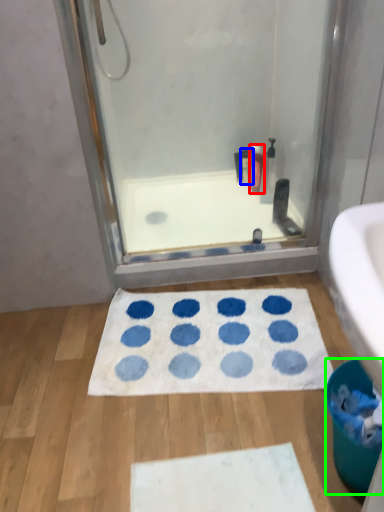
Question: Which object is positioned farthest from cleaning product (highlighted by a red box)? Select from toiletry (highlighted by a blue box) and toilet bowl (highlighted by a green box).

Choices:
 (A) toiletry
 (B) toilet bowl

Answer: (B)